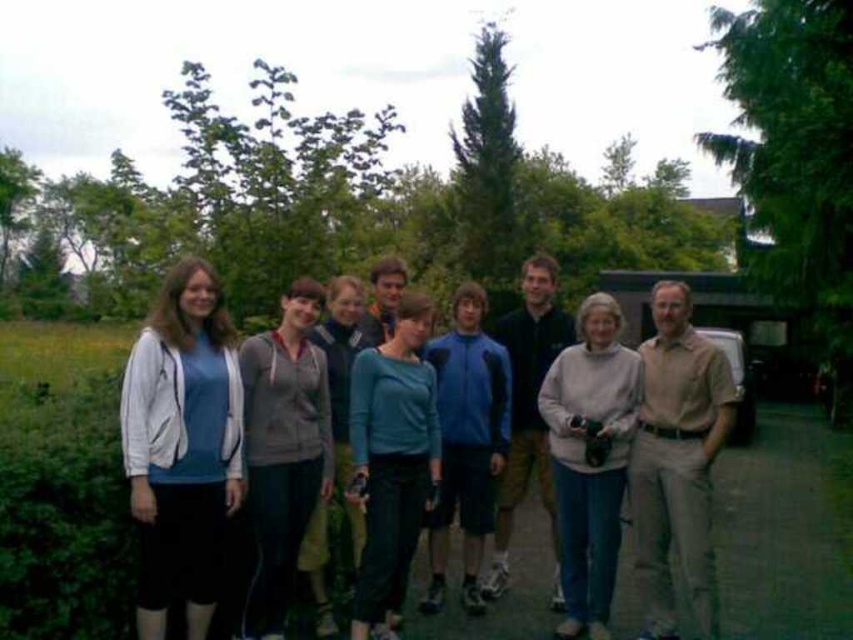
Question: Which point appears farthest from the camera in this image?

Choices:
 (A) (328, 449)
 (B) (274, 477)
 (C) (654, 317)
 (D) (527, 308)

Answer: (D)

Question: From the image, what is the correct spatial relationship of tan cotton shirt at right in relation to matte gray hoodie at center?

Choices:
 (A) above
 (B) below

Answer: (B)

Question: Which of the following is the farthest from the observer?

Choices:
 (A) (691, 406)
 (B) (422, 381)

Answer: (A)

Question: Does matte blue sweater at center appear on the right side of matte white jacket at left?

Choices:
 (A) yes
 (B) no

Answer: (A)

Question: Which of the following is the closest to the observer?

Choices:
 (A) light gray sweater at center
 (B) tan cotton shirt at right
 (C) matte blue sweater at center
 (D) matte gray hoodie at center

Answer: (C)

Question: Is matte white jacket at left above blue fleece jacket at center?

Choices:
 (A) yes
 (B) no

Answer: (A)